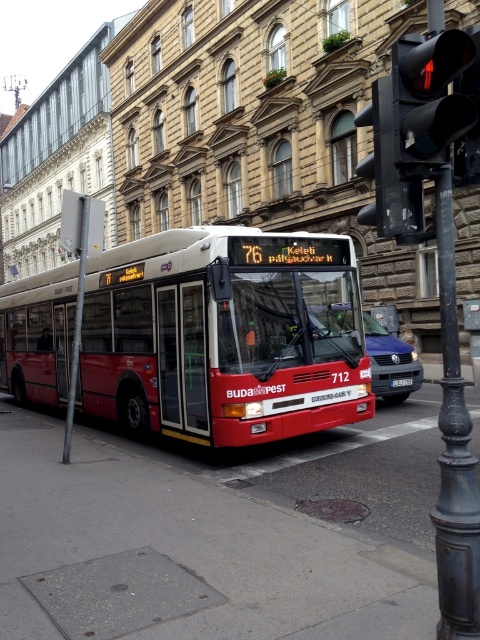
You are standing at the traffic light pole on the right side of the frame and want to walk to the metallic bus stop at center. In which direction should you walk to reach it?

The metallic bus stop at center is located at point [472,336] in 2D coordinates. Since you are at the traffic light pole on the right side, you should walk towards the center of the frame to reach the metallic bus stop at center.

You are a driver approaching the intersection and see the black glass traffic light at upper right and the black plastic license plate at center. Which object is wider?

The black glass traffic light at upper right is wider than the black plastic license plate at center.